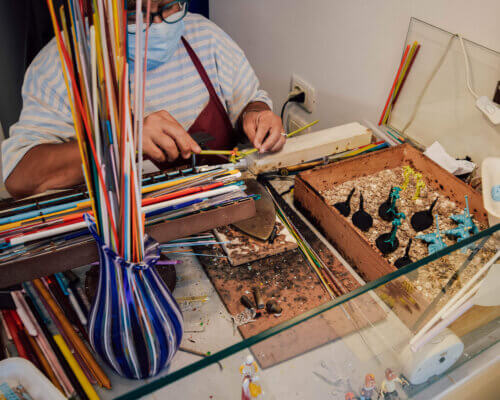
Identify the location of white switch. This screenshot has width=500, height=400. (485, 103).